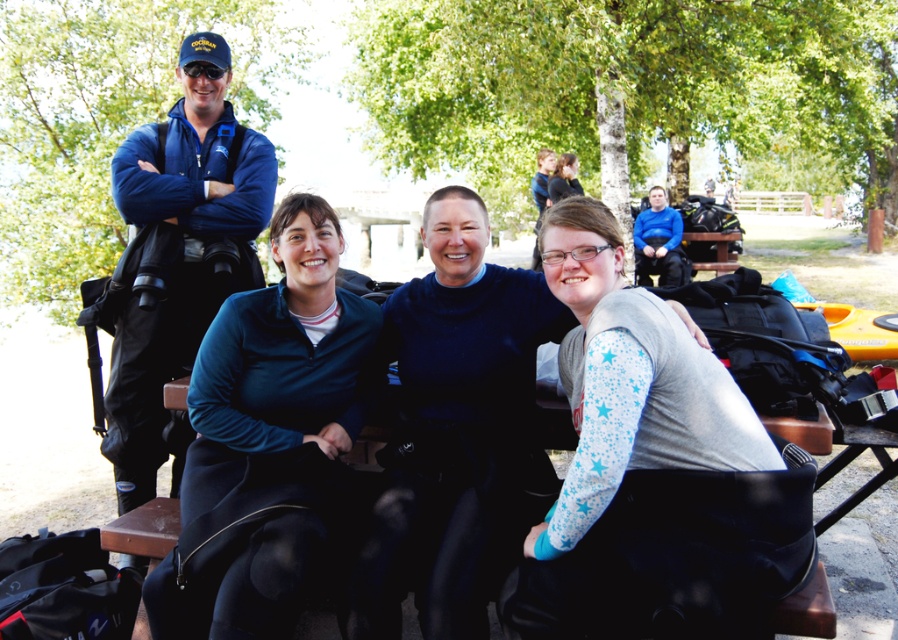
You are a photographer trying to capture a group photo of the white matte shirt at center and the matte black jacket at upper center. Based on their positions, which one would appear larger in the photo?

The white matte shirt at center appears larger in the photo because it is much taller than the matte black jacket at upper center.

You are planning to hang a small decoration between the blue fleece jacket at center and the matte black jacket at upper center. Which jacket should you attach the decoration to if you want it to hang lower?

The blue fleece jacket at center is much taller than the matte black jacket at upper center, so attaching the decoration to the matte black jacket at upper center will make it hang lower.